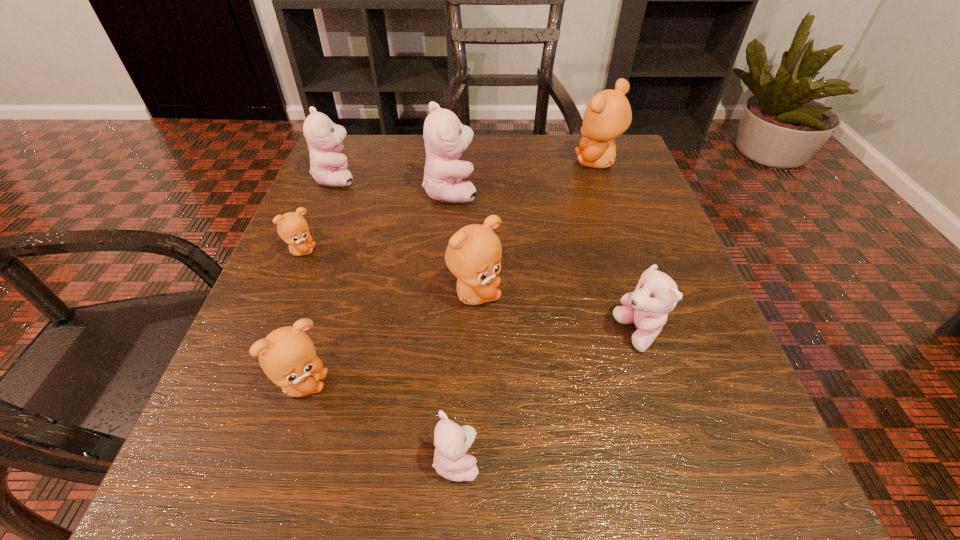
Image resolution: width=960 pixels, height=540 pixels. I want to click on vacant space positioned on the face of the second nearest object, so click(451, 384).

Image resolution: width=960 pixels, height=540 pixels. Find the location of `vacant space located 0.130m at the face of the rightmost pink teddy bear`. vacant space located 0.130m at the face of the rightmost pink teddy bear is located at coordinates (529, 334).

Locate an element on the screen. The height and width of the screenshot is (540, 960). vacant space located 0.120m at the face of the rightmost pink teddy bear is located at coordinates 536,334.

Where is `free space located at the face of the rightmost pink teddy bear`? The image size is (960, 540). free space located at the face of the rightmost pink teddy bear is located at coordinates (418, 334).

Locate an element on the screen. The width and height of the screenshot is (960, 540). free point located on the face of the fifth nearest object is located at coordinates (416, 251).

This screenshot has width=960, height=540. In order to click on vacant area located at the face of the smallest pink teddy bear in this screenshot , I will do `click(544, 460)`.

Identify the location of object at the near edge. The width and height of the screenshot is (960, 540). (452, 441).

Where is `object present at the far left corner`? object present at the far left corner is located at coordinates (328, 166).

The height and width of the screenshot is (540, 960). I want to click on object at the far right corner, so click(x=608, y=114).

This screenshot has width=960, height=540. Identify the location of free region at the far edge of the desktop. (512, 190).